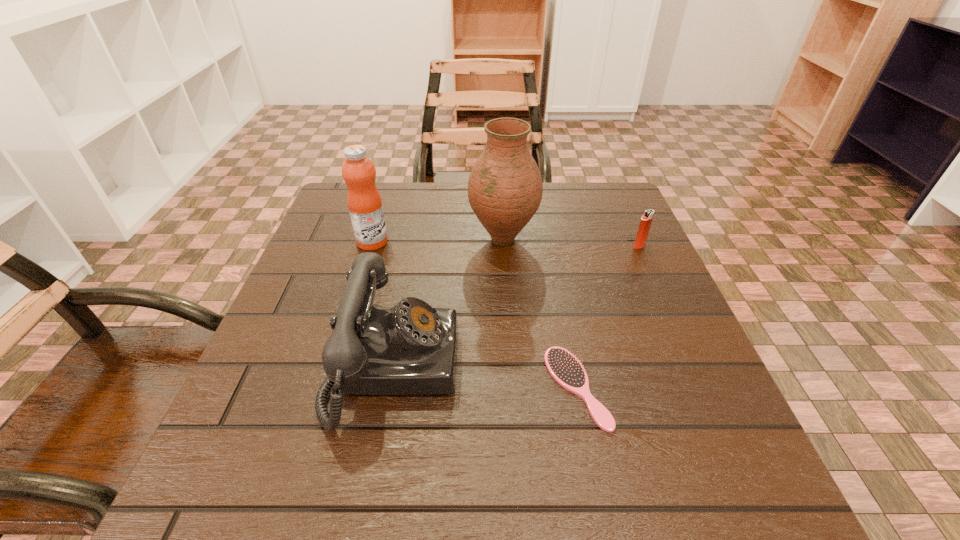
The image size is (960, 540). Identify the location of free area in between the igniter and the third tallest object. (516, 307).

You are a GUI agent. You are given a task and a screenshot of the screen. Output one action in this format:
    pyautogui.click(x=<x>, y=<y>)
    Task: Click on the vacant area between the hairbrush and the tallest object
    The width and height of the screenshot is (960, 540).
    Given the screenshot: What is the action you would take?
    pyautogui.click(x=540, y=313)

Where is `free point between the second shortest object and the hairbrush`? The height and width of the screenshot is (540, 960). free point between the second shortest object and the hairbrush is located at coordinates (608, 316).

Identify which object is the third nearest to the vase. Please provide its 2D coordinates. Your answer should be formatted as a tuple, i.e. [(x, y)], where the tuple contains the x and y coordinates of a point satisfying the conditions above.

[(645, 223)]

Locate an element on the screen. The height and width of the screenshot is (540, 960). the third closest object to the hairbrush is located at coordinates (645, 223).

Locate an element on the screen. vacant space that satisfies the following two spatial constraints: 1. on the front label of the fruit juice; 2. on the back side of the rightmost object is located at coordinates (372, 246).

This screenshot has width=960, height=540. I want to click on free point that satisfies the following two spatial constraints: 1. on the front label of the shortest object; 2. on the right side of the fourth shortest object, so point(327,387).

Locate an element on the screen. blank area in the image that satisfies the following two spatial constraints: 1. on the back side of the fourth tallest object; 2. on the right side of the hairbrush is located at coordinates [549, 246].

Identify the location of vacant region that satisfies the following two spatial constraints: 1. on the front label of the igniter; 2. on the left side of the fruit juice. This screenshot has width=960, height=540. (372, 246).